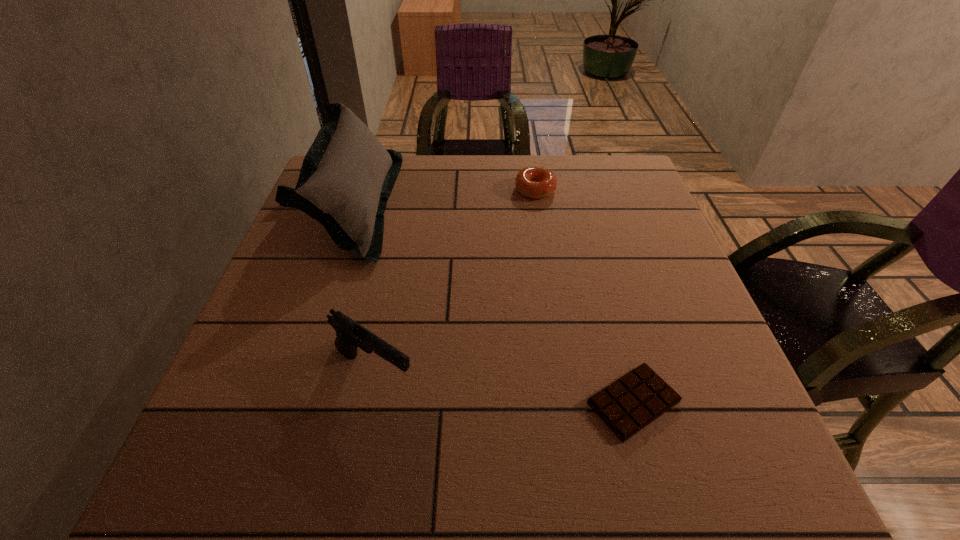
Where is `the tallest object`? The width and height of the screenshot is (960, 540). the tallest object is located at coordinates (347, 176).

Identify the location of the third shortest object. (350, 335).

Where is `the second shortest object`? The image size is (960, 540). the second shortest object is located at coordinates (534, 182).

In order to click on the shortest object in this screenshot , I will do `click(632, 402)`.

Where is `vacant region located on the surface of the cushion`? The height and width of the screenshot is (540, 960). vacant region located on the surface of the cushion is located at coordinates (535, 205).

This screenshot has width=960, height=540. I want to click on vacant area situated 0.060m at the muzzle of the gun, so click(x=453, y=372).

Identify the location of vacant space positioned on the left of the third tallest object. (481, 190).

At what (x,y) coordinates should I click in order to perform the action: click on vacant space located 0.140m on the back of the candy bar. Please return your answer as a coordinate pair (x, y). Looking at the image, I should click on (608, 307).

Where is `cushion that is at the far edge`? cushion that is at the far edge is located at coordinates (347, 176).

Identify the location of doughnut that is at the far edge. The image size is (960, 540). (534, 182).